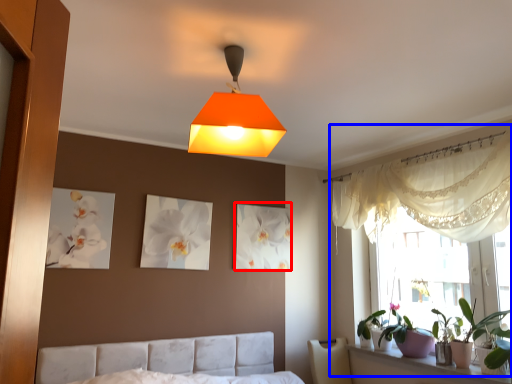
Question: Among these objects, which one is nearest to the camera, picture frame (highlighted by a red box) or bay window (highlighted by a blue box)?

Choices:
 (A) picture frame
 (B) bay window

Answer: (B)